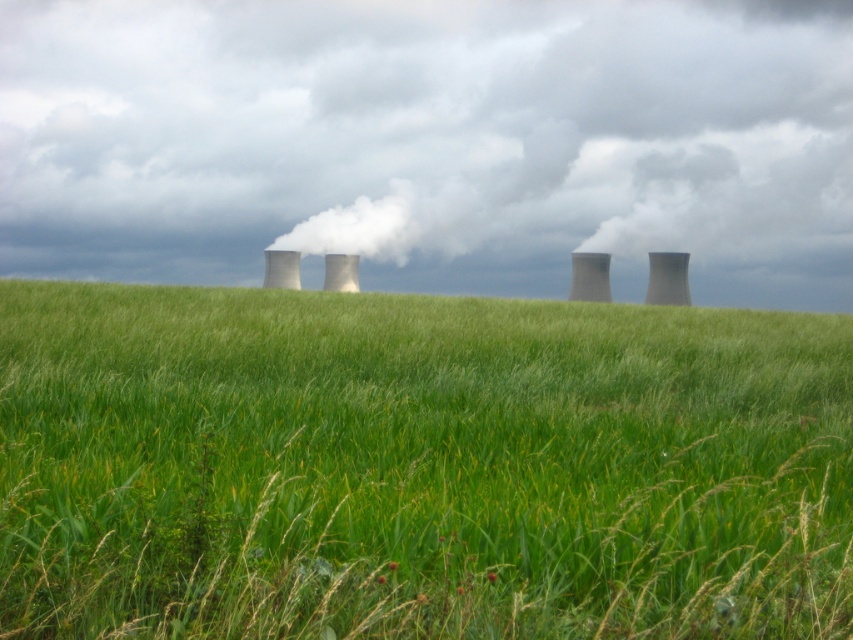
Question: Is green grassy field at center to the right of white smoke at upper center from the viewer's perspective?

Choices:
 (A) yes
 (B) no

Answer: (B)

Question: Which point is closer to the camera taking this photo?

Choices:
 (A) (604, 141)
 (B) (787, 384)

Answer: (B)

Question: Can you confirm if green grassy field at center is smaller than white smoke at upper center?

Choices:
 (A) no
 (B) yes

Answer: (B)

Question: Is green grassy field at center below white smoke at upper center?

Choices:
 (A) no
 (B) yes

Answer: (B)